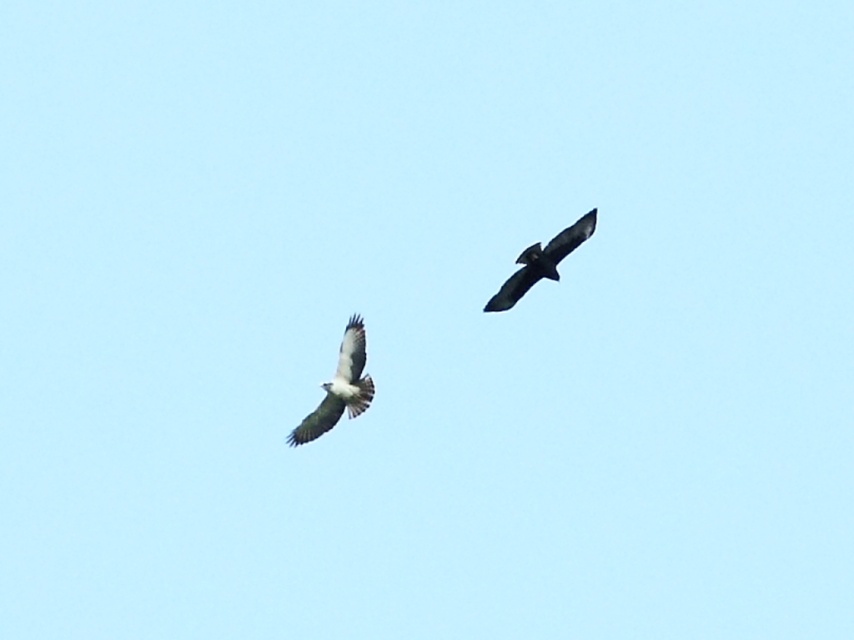
You are an ornithologist studying bird flight patterns. You observe the white feathered eagle at center in the sky. What are the exact coordinates of its position in the image?

The white feathered eagle at center is located at coordinates (338, 387).